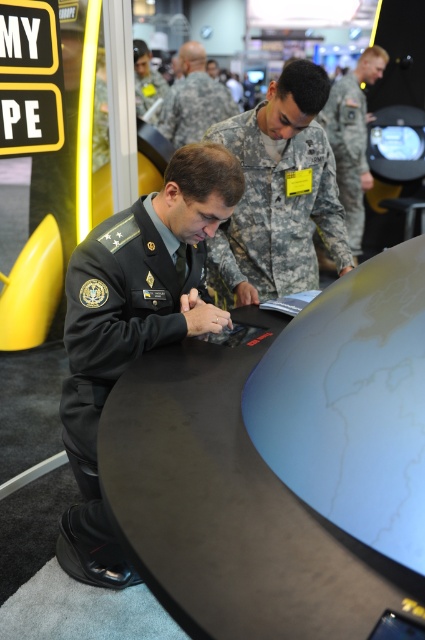
Question: Which object appears farthest from the camera in this image?

Choices:
 (A) camouflage fabric uniform at upper center
 (B) camouflage uniform at center
 (C) camouflage fabric uniform at center

Answer: (B)

Question: Is camouflage fabric uniform at center in front of camouflage fabric uniform at upper center?

Choices:
 (A) no
 (B) yes

Answer: (B)

Question: Is camouflage fabric uniform at center positioned in front of camouflage uniform at center?

Choices:
 (A) no
 (B) yes

Answer: (B)

Question: Which point appears closest to the camera in this image?

Choices:
 (A) (88, 294)
 (B) (223, 230)
 (C) (359, 115)

Answer: (A)

Question: Is camouflage fabric uniform at center thinner than matte black uniform at upper center?

Choices:
 (A) no
 (B) yes

Answer: (A)

Question: Among these objects, which one is nearest to the camera?

Choices:
 (A) camouflage fabric uniform at upper center
 (B) matte black uniform at upper center
 (C) black matte table at center

Answer: (C)